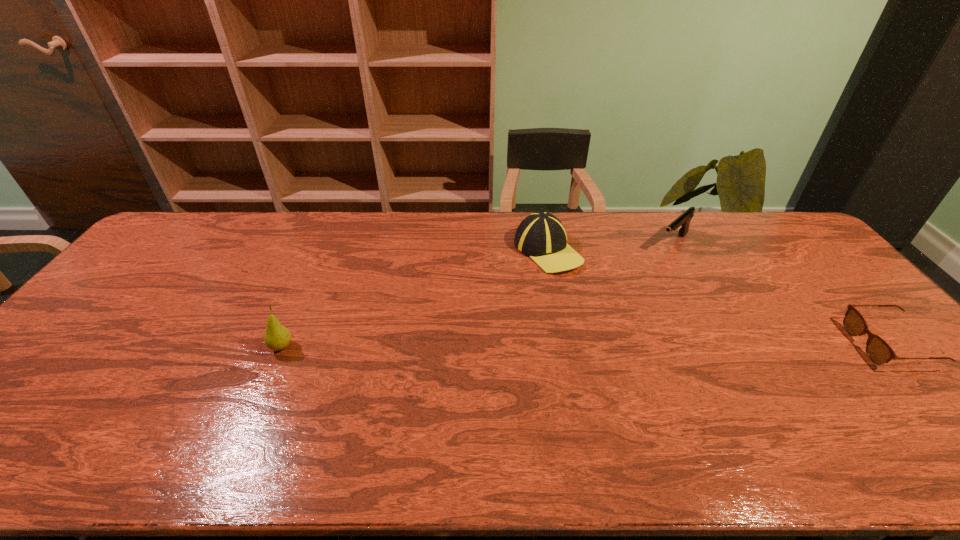
The height and width of the screenshot is (540, 960). What are the coordinates of `vacant space on the desktop that is between the pear and the rightmost object and is positioned with the brim of the baseball cap facing forward` in the screenshot? It's located at (613, 346).

Where is `free space on the desktop that is between the pear and the rightmost object and is positioned at the muzzle of the pistol`? The width and height of the screenshot is (960, 540). free space on the desktop that is between the pear and the rightmost object and is positioned at the muzzle of the pistol is located at coordinates (557, 346).